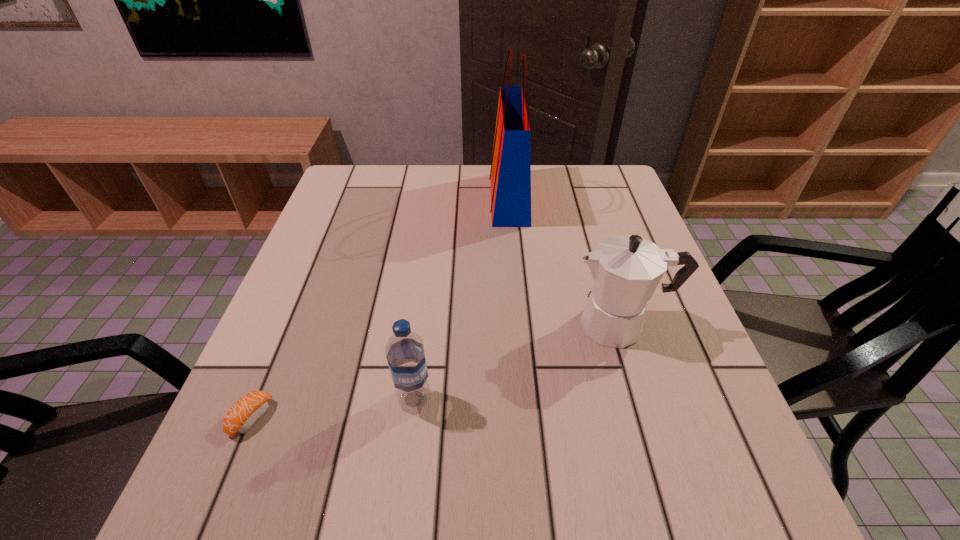
Identify the location of vacant space located 0.250m on the handle side of the farthest object. (402, 199).

You are a GUI agent. You are given a task and a screenshot of the screen. Output one action in this format:
    pyautogui.click(x=<x>, y=<y>)
    Task: Click on the vacant space located 0.270m at the spout of the rightmost object
    
    Given the screenshot: What is the action you would take?
    pyautogui.click(x=440, y=325)

Locate an element on the screen. vacant space located 0.350m at the spout of the rightmost object is located at coordinates (401, 325).

This screenshot has width=960, height=540. What are the coordinates of `vacant space positioned 0.130m at the spout of the rightmost object` in the screenshot? It's located at (506, 325).

Where is `vacant space located on the label of the second shortest object`? The image size is (960, 540). vacant space located on the label of the second shortest object is located at coordinates (400, 513).

The width and height of the screenshot is (960, 540). I want to click on vacant area situated on the back of the sushi, so click(316, 262).

Locate an element on the screen. The image size is (960, 540). object at the far edge is located at coordinates (510, 176).

You are a GUI agent. You are given a task and a screenshot of the screen. Output one action in this format:
    pyautogui.click(x=<x>, y=<y>)
    Task: Click on the object located in the left edge section of the desktop
    
    Given the screenshot: What is the action you would take?
    pyautogui.click(x=246, y=411)

Find the location of `object located in the right edge section of the desktop`. object located in the right edge section of the desktop is located at coordinates (626, 269).

Find the location of a particular element. The width and height of the screenshot is (960, 540). vacant area at the far edge is located at coordinates (551, 168).